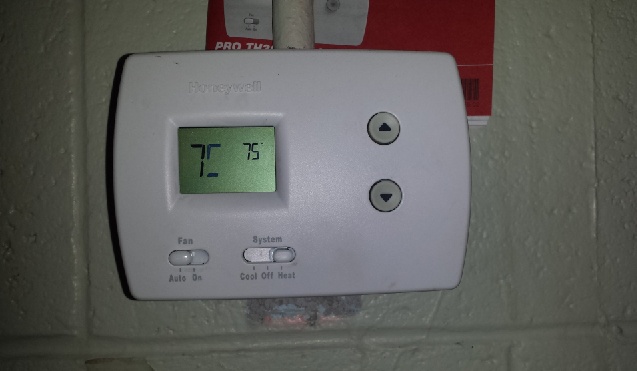
Locate an element on the screen. switch is located at coordinates (182, 274).